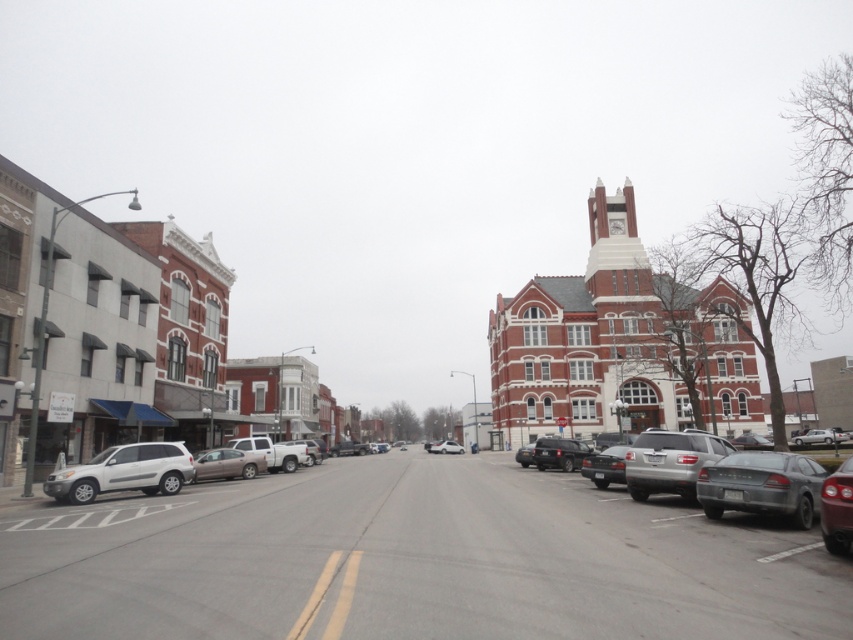
Question: Does satin silver suv at lower left have a smaller size compared to satin silver suv at lower right?

Choices:
 (A) yes
 (B) no

Answer: (A)

Question: Which object is positioned closest to the red brick church at center?

Choices:
 (A) shiny red sedan at right
 (B) gray metallic sedan at right
 (C) silver metallic sedan at center-left
 (D) satin silver suv at lower left

Answer: (D)

Question: Is the position of gray metallic sedan at right less distant than that of matte silver sedan at center?

Choices:
 (A) yes
 (B) no

Answer: (A)

Question: Is satin silver suv at lower left positioned behind shiny red sedan at right?

Choices:
 (A) no
 (B) yes

Answer: (B)

Question: Among these objects, which one is nearest to the camera?

Choices:
 (A) silver metallic sedan at right
 (B) satin silver suv at lower right
 (C) matte silver sedan at center

Answer: (A)

Question: Estimate the real-world distances between objects in this image. Which object is farther from the silver metallic sedan at right?

Choices:
 (A) satin silver suv at lower left
 (B) satin silver suv at lower right
 (C) silver metallic sedan at center-left
 (D) matte silver sedan at center

Answer: (D)